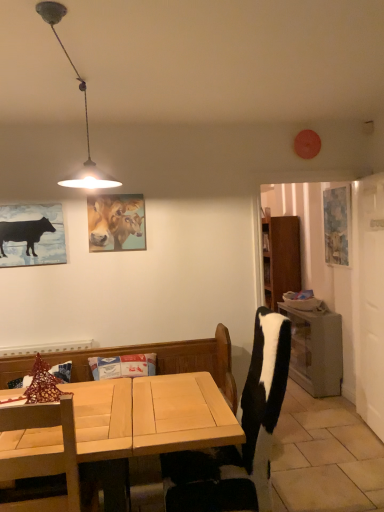
Identify the location of free space in front of wooden table at right. (311, 403).